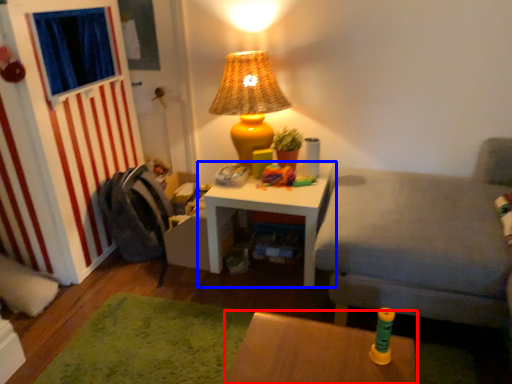
Question: Which of the following is the closest to the observer, table (highlighted by a red box) or table (highlighted by a blue box)?

Choices:
 (A) table
 (B) table

Answer: (A)